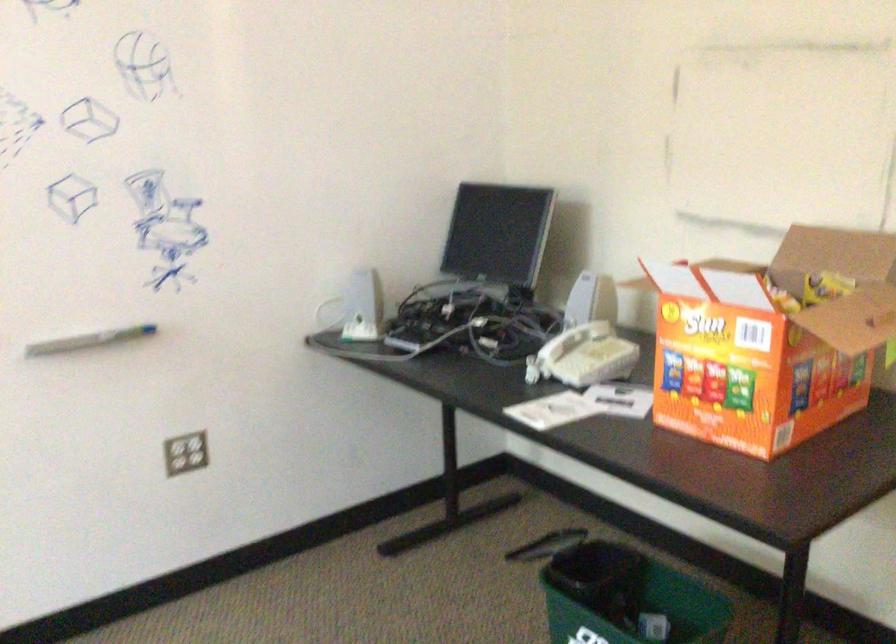
The location [627,599] corresponds to which object?

It corresponds to the green trash can in the image.